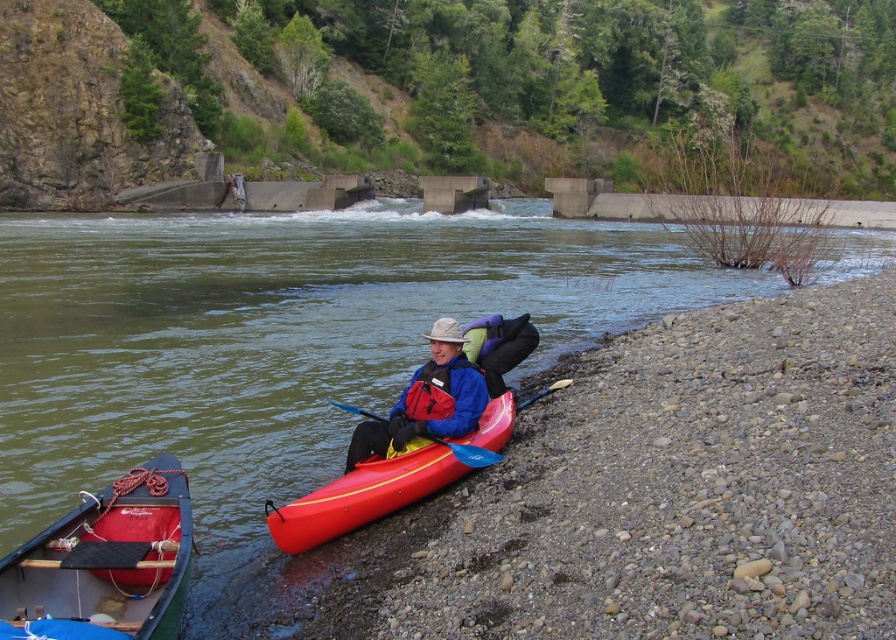
Question: Which object appears farthest from the camera in this image?

Choices:
 (A) matte blue jacket at center
 (B) purple fabric backpack at center
 (C) black textured paddle at lower left
 (D) greenish-brown water at center

Answer: (B)

Question: Considering the relative positions of greenish-brown water at center and rubberized red canoe at lower left in the image provided, where is greenish-brown water at center located with respect to rubberized red canoe at lower left?

Choices:
 (A) right
 (B) left

Answer: (A)

Question: Estimate the real-world distances between objects in this image. Which object is farther from the greenish-brown water at center?

Choices:
 (A) blue plastic paddle at center
 (B) matte blue jacket at center

Answer: (A)

Question: From the image, what is the correct spatial relationship of black textured paddle at lower left in relation to blue plastic paddle at center?

Choices:
 (A) below
 (B) above

Answer: (A)

Question: Which point is farther to the camera?

Choices:
 (A) (160, 584)
 (B) (342, 403)
 (C) (484, 317)
 (D) (205, 433)

Answer: (B)

Question: From the image, what is the correct spatial relationship of rubberized red canoe at lower left in relation to purple fabric backpack at center?

Choices:
 (A) below
 (B) above

Answer: (A)